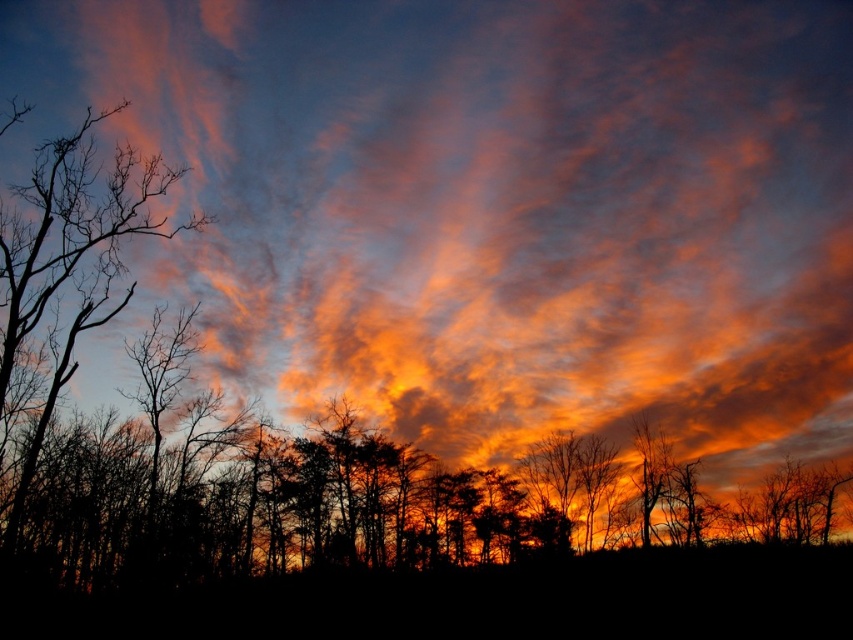
You are an artist sketching the sunset scene. You want to draw the silhouette tree at center and the silhouette bare tree at left. Which tree should you draw first to ensure proper layering?

You should draw the silhouette tree at center first because the silhouette bare tree at left is behind it, so you need to layer the silhouette tree at center over the silhouette bare tree at left.

You are an observer standing in front of the sunset scene. You notice two trees in the foreground. The first is the silhouette tree at center, and the second is the silhouette bare tree at left. Which of these two trees is taller?

The silhouette bare tree at left is taller than the silhouette tree at center.